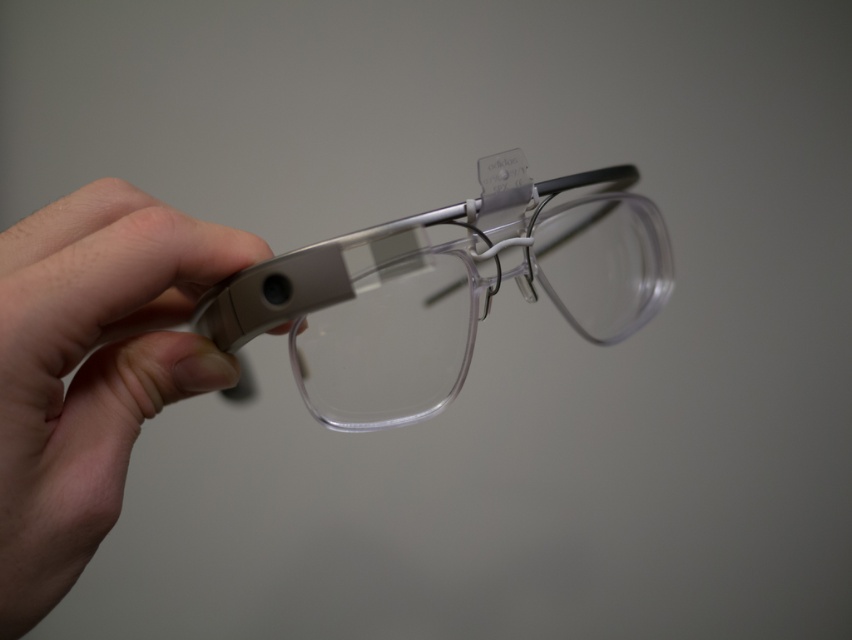
You are a designer examining the glasses in the image. You need to determine which of the two points, point (58, 525) or point (311, 404), is closer to the viewer. Based on the spatial relationship between these points, which one should you focus on first?

Point (58, 525) is closer to the viewer than point (311, 404), so you should focus on point (58, 525) first.

You are a designer evaluating the ergonomics of the clear plastic glasses at center. Considering the skin tone flesh hand at left, which object has a greater width when viewed from the front?

The clear plastic glasses at center are wider than the skin tone flesh hand at left because the hand is thinner than the glasses.